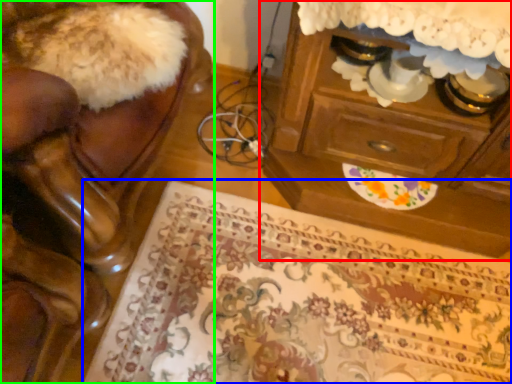
Question: Which object is the closest to the chest of drawers (highlighted by a red box)? Choose among these: mat (highlighted by a blue box) or furniture (highlighted by a green box).

Choices:
 (A) mat
 (B) furniture

Answer: (A)